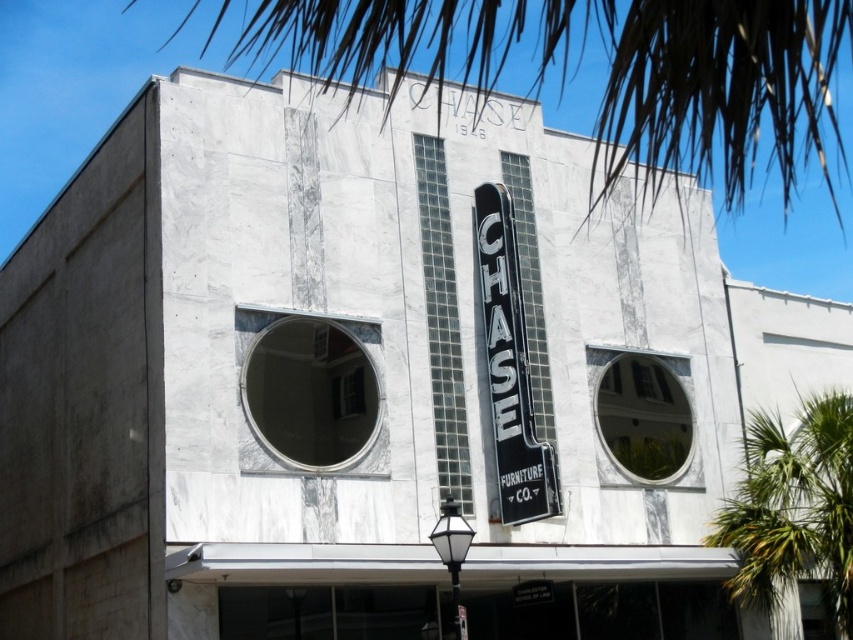
Question: Which of the following is the farthest from the observer?

Choices:
 (A) green leafy palm tree at right
 (B) black metal sign at center
 (C) brown leafy palm tree at upper center

Answer: (A)

Question: Which object appears farthest from the camera in this image?

Choices:
 (A) black metal sign at center
 (B) green leafy palm tree at right
 (C) brown leafy palm tree at upper center

Answer: (B)

Question: Based on their relative distances, which object is farther from the brown leafy palm tree at upper center?

Choices:
 (A) green leafy palm tree at right
 (B) black metal sign at center

Answer: (B)

Question: In this image, where is brown leafy palm tree at upper center located relative to black metal sign at center?

Choices:
 (A) above
 (B) below

Answer: (A)

Question: Is green leafy palm tree at right smaller than black metal sign at center?

Choices:
 (A) no
 (B) yes

Answer: (A)

Question: Does brown leafy palm tree at upper center appear on the left side of black metal sign at center?

Choices:
 (A) no
 (B) yes

Answer: (B)